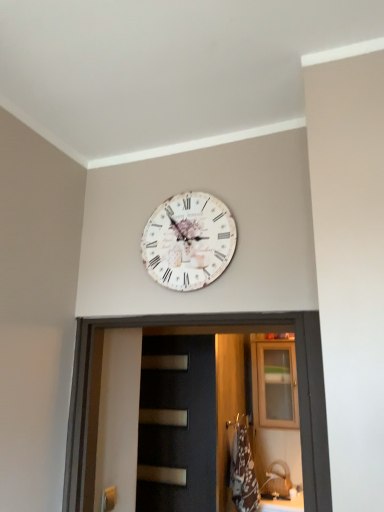
Question: Can you confirm if black matte door at center is positioned to the right of white vintage clock at upper center?

Choices:
 (A) yes
 (B) no

Answer: (B)

Question: Is black matte door at center beside white vintage clock at upper center?

Choices:
 (A) yes
 (B) no

Answer: (B)

Question: Is black matte door at center closer to the viewer compared to white vintage clock at upper center?

Choices:
 (A) no
 (B) yes

Answer: (A)

Question: From a real-world perspective, is black matte door at center over white vintage clock at upper center?

Choices:
 (A) yes
 (B) no

Answer: (B)

Question: Is black matte door at center facing away from white vintage clock at upper center?

Choices:
 (A) yes
 (B) no

Answer: (B)

Question: From a real-world perspective, is black matte door at center physically located above or below wooden cabinet at upper center?

Choices:
 (A) above
 (B) below

Answer: (B)

Question: Based on their positions, is black matte door at center located to the left or right of wooden cabinet at upper center?

Choices:
 (A) left
 (B) right

Answer: (A)

Question: From the image's perspective, is black matte door at center located above or below wooden cabinet at upper center?

Choices:
 (A) below
 (B) above

Answer: (B)

Question: Is black matte door at center inside the boundaries of wooden cabinet at upper center, or outside?

Choices:
 (A) outside
 (B) inside

Answer: (A)

Question: Is white vintage clock at upper center spatially inside black matte door at center, or outside of it?

Choices:
 (A) outside
 (B) inside

Answer: (A)

Question: From the image's perspective, is white vintage clock at upper center located above or below black matte door at center?

Choices:
 (A) above
 (B) below

Answer: (A)

Question: From a real-world perspective, is white vintage clock at upper center positioned above or below black matte door at center?

Choices:
 (A) above
 (B) below

Answer: (A)

Question: Considering the positions of white vintage clock at upper center and black matte door at center in the image, is white vintage clock at upper center bigger or smaller than black matte door at center?

Choices:
 (A) big
 (B) small

Answer: (B)

Question: Is white vintage clock at upper center in front of or behind wooden cabinet at upper center in the image?

Choices:
 (A) behind
 (B) front

Answer: (B)

Question: In terms of size, does white vintage clock at upper center appear bigger or smaller than wooden cabinet at upper center?

Choices:
 (A) small
 (B) big

Answer: (A)